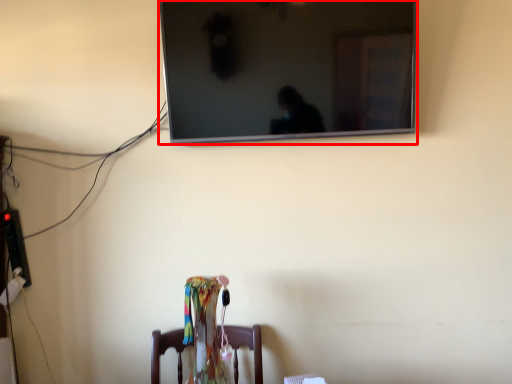
Question: From the image's perspective, what is the correct spatial positioning of television (annotated by the red box) in reference to furniture?

Choices:
 (A) above
 (B) below

Answer: (A)